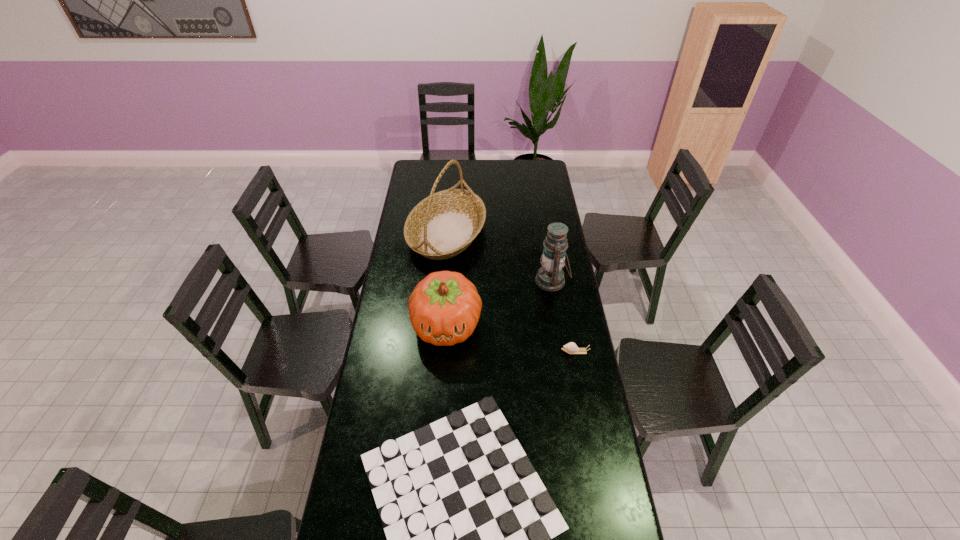
This screenshot has width=960, height=540. In order to click on empty space between the oil lamp and the third shortest object in this screenshot , I will do `click(499, 303)`.

Where is `vacant region between the third shortest object and the fourth shortest object`? The width and height of the screenshot is (960, 540). vacant region between the third shortest object and the fourth shortest object is located at coordinates (499, 303).

Identify the location of unoccupied area between the oil lamp and the escargot. Image resolution: width=960 pixels, height=540 pixels. (564, 316).

At what (x,y) coordinates should I click in order to perform the action: click on empty space that is in between the oil lamp and the escargot. Please return your answer as a coordinate pair (x, y). Looking at the image, I should click on (564, 316).

You are a GUI agent. You are given a task and a screenshot of the screen. Output one action in this format:
    pyautogui.click(x=<x>, y=<y>)
    Task: Click on the object that stands as the second closest to the nearest object
    The image size is (960, 540).
    Given the screenshot: What is the action you would take?
    pyautogui.click(x=571, y=348)

Point out which object is positioned as the second nearest to the fourth tallest object. Please provide its 2D coordinates. Your answer should be formatted as a tuple, i.e. [(x, y)], where the tuple contains the x and y coordinates of a point satisfying the conditions above.

[(550, 277)]